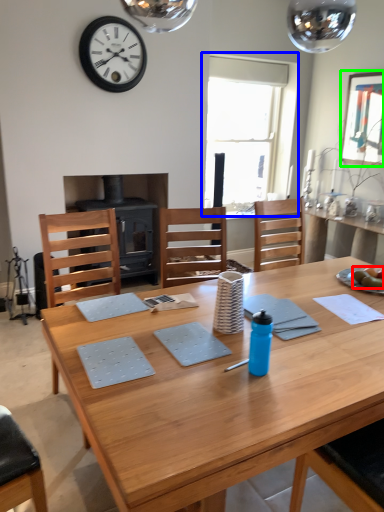
Question: Which object is positioned farthest from food (highlighted by a red box)? Select from window (highlighted by a blue box) and picture frame (highlighted by a green box).

Choices:
 (A) window
 (B) picture frame

Answer: (A)